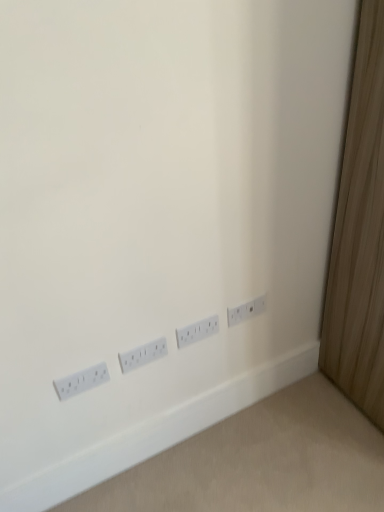
Question: Considering the positions of white plastic power plugs and sockets at lower right, the fourth power plugs and sockets viewed from the left, and white plastic power plugs and sockets at lower left, the fourth power plugs and sockets viewed from the right, in the image, is white plastic power plugs and sockets at lower right, the fourth power plugs and sockets viewed from the left, bigger or smaller than white plastic power plugs and sockets at lower left, the fourth power plugs and sockets viewed from the right,?

Choices:
 (A) big
 (B) small

Answer: (B)

Question: Choose the correct answer: Is white plastic power plugs and sockets at lower right, the fourth power plugs and sockets viewed from the left, inside white plastic power plugs and sockets at lower left, the fourth power plugs and sockets viewed from the right, or outside it?

Choices:
 (A) inside
 (B) outside

Answer: (B)

Question: Considering the real-world distances, which object is farthest from the white plastic power plugs and sockets at lower right, which is counted as the 2th power plugs and sockets, starting from the right?

Choices:
 (A) white plastic power plugs and sockets at lower left, the 1th power plugs and sockets in the left-to-right sequence
 (B) white plastic power plugs and sockets at center, marked as the third power plugs and sockets in a right-to-left arrangement
 (C) white plastic power plugs and sockets at lower right, the fourth power plugs and sockets viewed from the left

Answer: (A)

Question: Which object is the farthest from the white plastic power plugs and sockets at lower right, the 3th power plugs and sockets from the left?

Choices:
 (A) white plastic power plugs and sockets at lower left, the 1th power plugs and sockets in the left-to-right sequence
 (B) white plastic power plugs and sockets at center, positioned as the second power plugs and sockets in left-to-right order
 (C) white plastic power plugs and sockets at lower right, the fourth power plugs and sockets viewed from the left

Answer: (A)